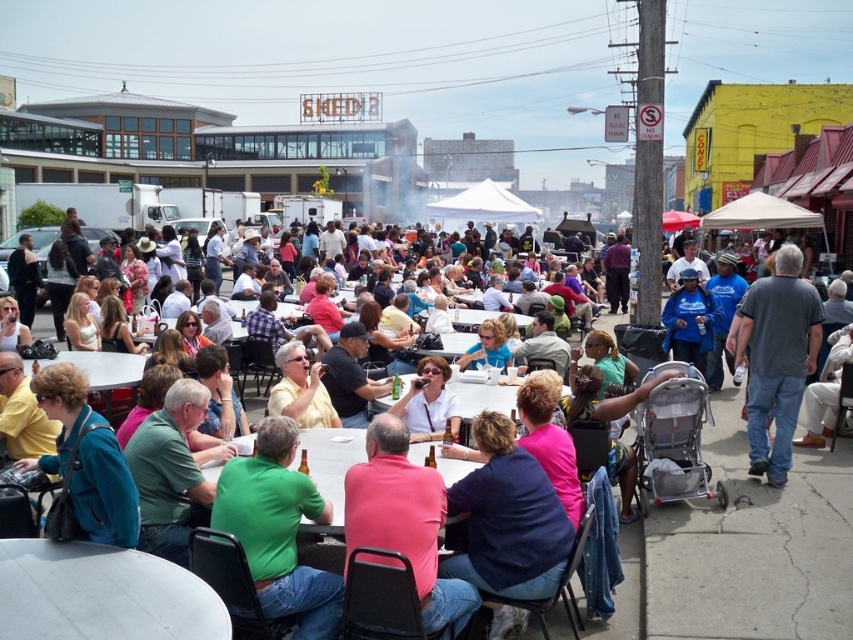
Based on the photo, does pink fabric shirt at center have a greater width compared to yellow matte shirt at center?

No, pink fabric shirt at center is not wider than yellow matte shirt at center.

How much distance is there between pink fabric shirt at center and yellow matte shirt at center?

They are 8.12 meters apart.

Where is `pink fabric shirt at center`? The width and height of the screenshot is (853, 640). pink fabric shirt at center is located at coordinates (753, 548).

Which is behind, point (288, 602) or point (308, 368)?

Point (308, 368)

Can you confirm if green matte shirt at center is positioned above yellow matte shirt at center?

No.

Is point (224, 513) positioned after point (286, 346)?

No, it is in front of (286, 346).

This screenshot has width=853, height=640. What are the coordinates of `green matte shirt at center` in the screenshot? It's located at (277, 529).

Which is more to the left, yellow matte shirt at center or white plastic table at center?

Positioned to the left is yellow matte shirt at center.

Which is below, yellow matte shirt at center or white plastic table at center?

white plastic table at center is below.

Is point (316, 400) closer to viewer compared to point (403, 378)?

Yes, it is in front of point (403, 378).

Identify the location of yellow matte shirt at center. The width and height of the screenshot is (853, 640). (300, 388).